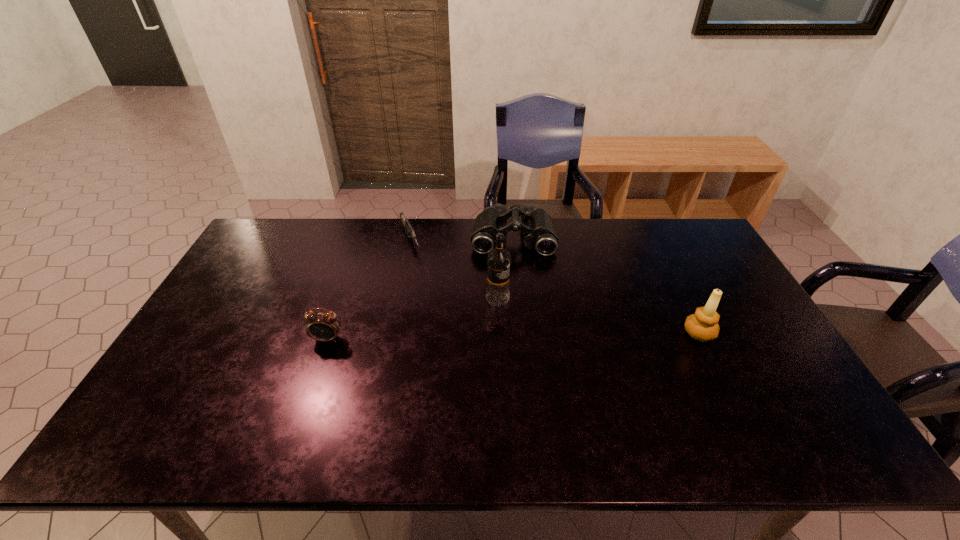
Find the location of a particular element. Image resolution: width=960 pixels, height=540 pixels. gun located in the far edge section of the desktop is located at coordinates (411, 234).

In order to click on object present at the right edge in this screenshot , I will do `click(703, 325)`.

Where is `free space at the far edge`? free space at the far edge is located at coordinates (408, 238).

Where is `vacant space at the near edge of the desktop`? vacant space at the near edge of the desktop is located at coordinates (234, 385).

I want to click on vacant position at the left edge of the desktop, so click(x=255, y=291).

I want to click on free region at the right edge of the desktop, so click(680, 272).

At what (x,y) coordinates should I click in order to perform the action: click on blank space at the far left corner of the desktop. Please return your answer as a coordinate pair (x, y). The image size is (960, 540). Looking at the image, I should click on (279, 244).

Locate an element on the screen. blank space at the far right corner is located at coordinates (705, 248).

This screenshot has width=960, height=540. I want to click on free space between the second tallest object and the tallest object, so click(598, 316).

Where is `free space that is in between the alarm clock and the fourth shortest object`? The width and height of the screenshot is (960, 540). free space that is in between the alarm clock and the fourth shortest object is located at coordinates (514, 336).